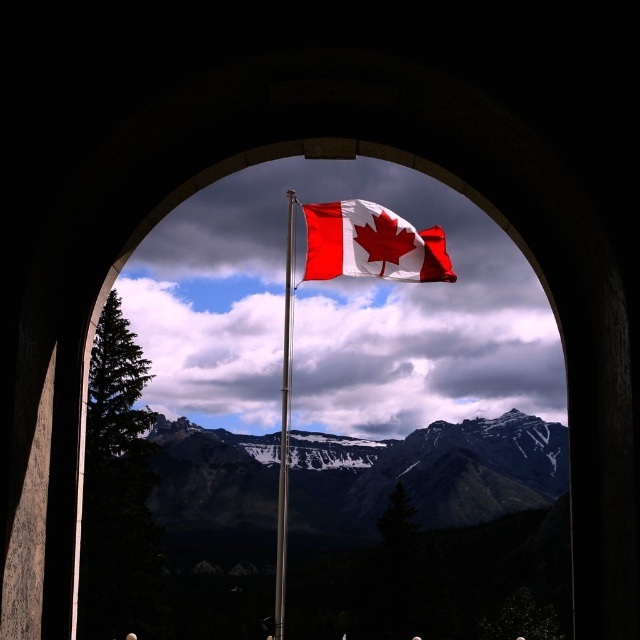
Which is in front, point (289, 490) or point (429, 262)?

Point (429, 262) is more forward.

Between point (419, 461) and point (396, 241), which one is positioned behind?

The point (419, 461) is more distant.

Is point (490, 476) in front of point (394, 227)?

No, it is not.

What are the coordinates of `snow-covered rocky mountain at center` in the screenshot? It's located at (426, 474).

Can you confirm if snow-covered rocky mountain at center is bigger than polished metal flag pole at center?

Yes.

At what (x,y) coordinates should I click in order to perform the action: click on snow-covered rocky mountain at center. Please return your answer as a coordinate pair (x, y). The height and width of the screenshot is (640, 640). Looking at the image, I should click on (426, 474).

Is point (476, 452) more distant than point (288, 454)?

That is True.

You are a GUI agent. You are given a task and a screenshot of the screen. Output one action in this format:
    pyautogui.click(x=<x>, y=<y>)
    Task: Click on the snow-covered rocky mountain at center
    This screenshot has width=640, height=640.
    Given the screenshot: What is the action you would take?
    tap(426, 474)

Measure the distance between red and white fabric flag at center and polished metal flag pole at center.

red and white fabric flag at center is 41.63 meters away from polished metal flag pole at center.

Who is positioned more to the left, red and white fabric flag at center or polished metal flag pole at center?

Positioned to the left is polished metal flag pole at center.

Does point (323, 212) come in front of point (285, 413)?

Yes, it is.

Where is `red and white fabric flag at center`? The height and width of the screenshot is (640, 640). red and white fabric flag at center is located at coordinates (371, 244).